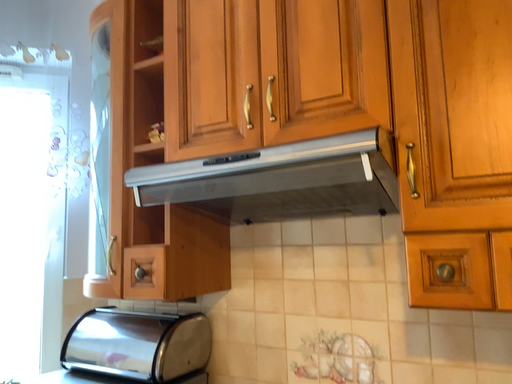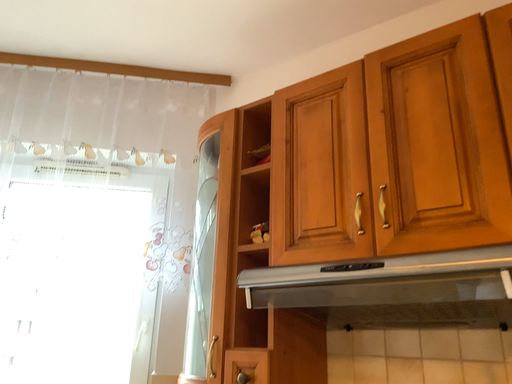
Question: How did the camera likely rotate when shooting the video?

Choices:
 (A) rotated right
 (B) rotated left

Answer: (B)